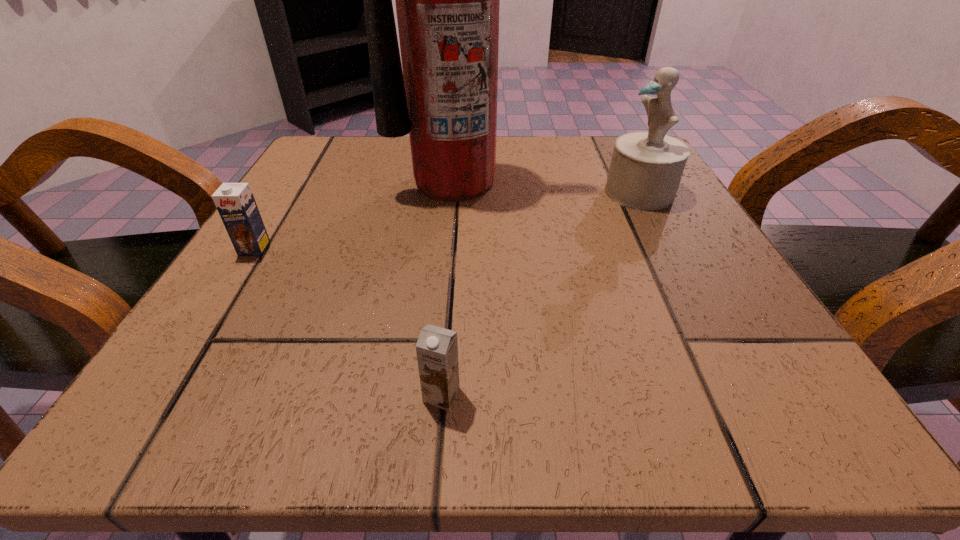
Find the location of `vacant space at the near edge of the desktop`. vacant space at the near edge of the desktop is located at coordinates (646, 386).

Image resolution: width=960 pixels, height=540 pixels. I want to click on vacant space at the left edge of the desktop, so click(275, 314).

This screenshot has width=960, height=540. In the image, there is a desktop. In order to click on blank space at the right edge in this screenshot , I will do `click(735, 303)`.

At what (x,y) coordinates should I click in order to perform the action: click on vacant space at the far left corner. Please return your answer as a coordinate pair (x, y). The width and height of the screenshot is (960, 540). Looking at the image, I should click on (348, 146).

Find the location of a particular element. The width and height of the screenshot is (960, 540). vacant area at the near left corner of the desktop is located at coordinates (279, 415).

This screenshot has width=960, height=540. Identify the location of vacant region at the near right corner. (765, 423).

The width and height of the screenshot is (960, 540). Find the location of `vacant area that lies between the nearer chocolate milk and the second tallest object`. vacant area that lies between the nearer chocolate milk and the second tallest object is located at coordinates (540, 294).

Where is `free space that is in between the right chocolate milk and the rightmost object`? free space that is in between the right chocolate milk and the rightmost object is located at coordinates (540, 294).

Find the location of `vacant area that lies between the farther chocolate milk and the figurine`. vacant area that lies between the farther chocolate milk and the figurine is located at coordinates (447, 220).

The height and width of the screenshot is (540, 960). What are the coordinates of `free space between the fire extinguisher and the nearest object` in the screenshot? It's located at (447, 288).